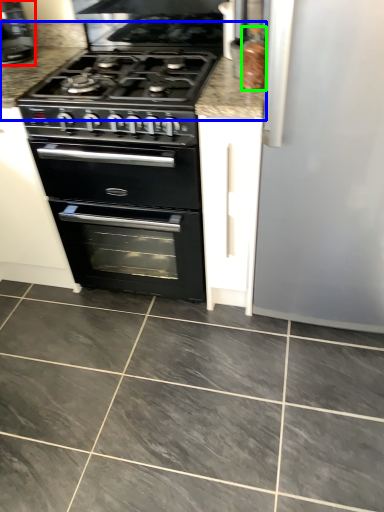
Question: Which is nearer to the coffee machine (highlighted by a red box)? counter top (highlighted by a blue box) or appliance (highlighted by a green box).

Choices:
 (A) counter top
 (B) appliance

Answer: (A)